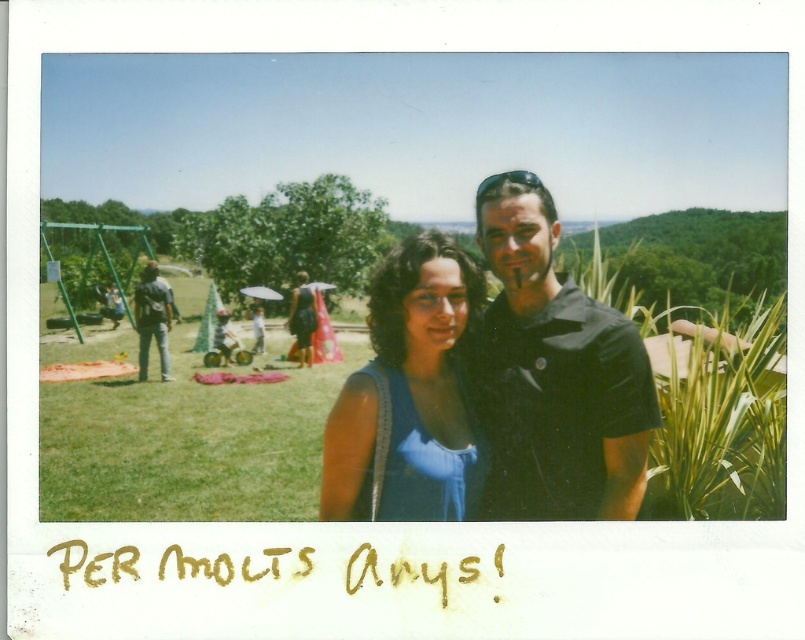
Question: Considering the relative positions of blue satin dress at center and denim jeans at left in the image provided, where is blue satin dress at center located with respect to denim jeans at left?

Choices:
 (A) right
 (B) left

Answer: (A)

Question: Which of the following is the farthest from the observer?

Choices:
 (A) (781, 406)
 (B) (138, 356)

Answer: (B)

Question: Which of the following is the closest to the observer?

Choices:
 (A) (473, 280)
 (B) (621, 368)
 (C) (161, 340)
 (D) (537, 390)

Answer: (B)

Question: Does black matte shirt at center appear under blue satin dress at center?

Choices:
 (A) no
 (B) yes

Answer: (A)

Question: Which point is farther to the camera?

Choices:
 (A) (489, 244)
 (B) (411, 396)
 (C) (138, 305)

Answer: (C)

Question: Is matte blue dress at center bigger than denim jeans at left?

Choices:
 (A) no
 (B) yes

Answer: (B)